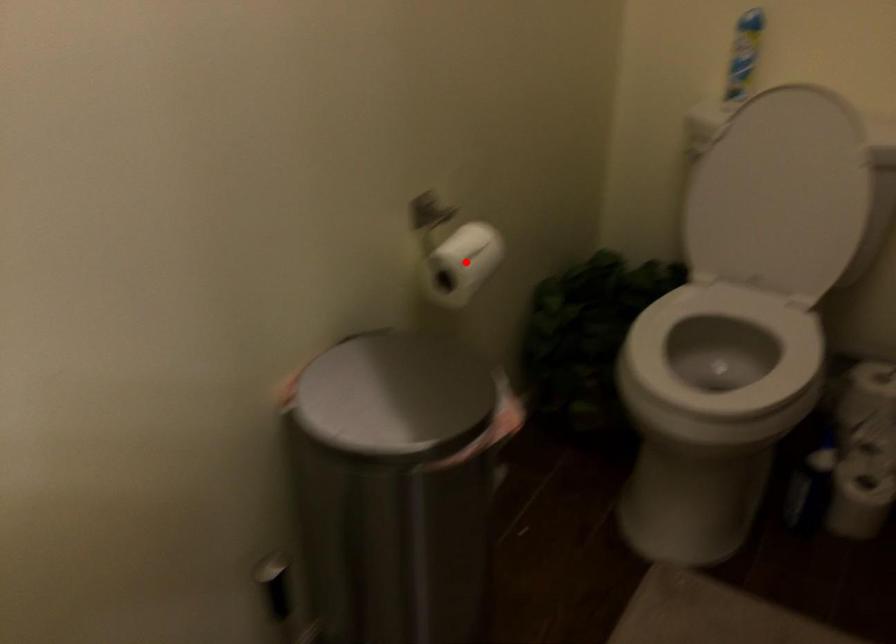
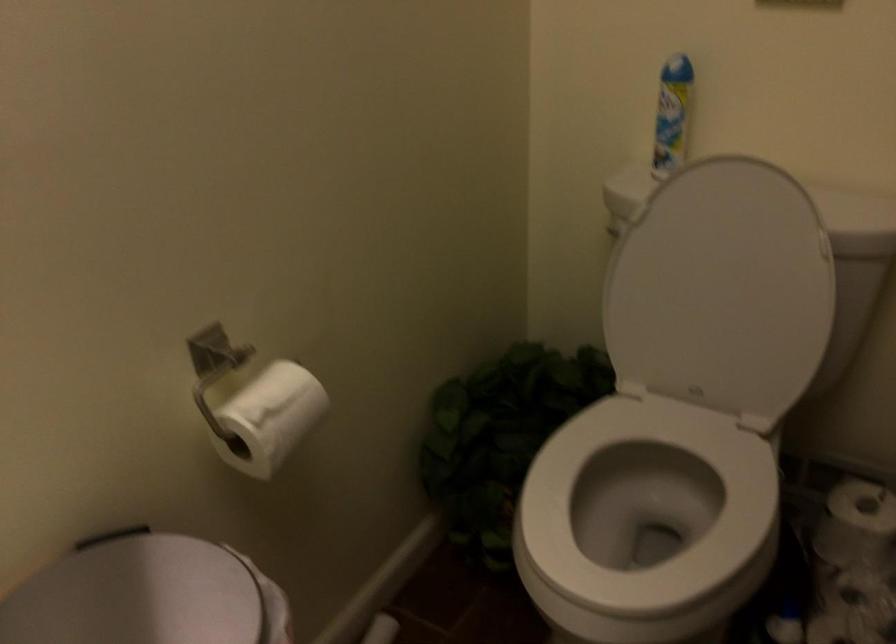
Where in the second image is the point corresponding to the highlighted location from the first image?

(271, 417)